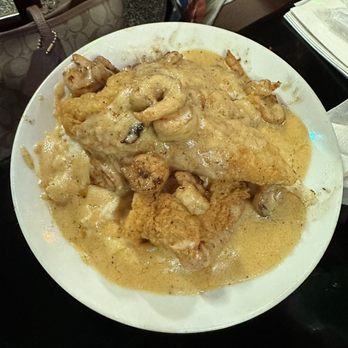
The height and width of the screenshot is (348, 348). Find the location of `wood part of table`. wood part of table is located at coordinates (244, 20).